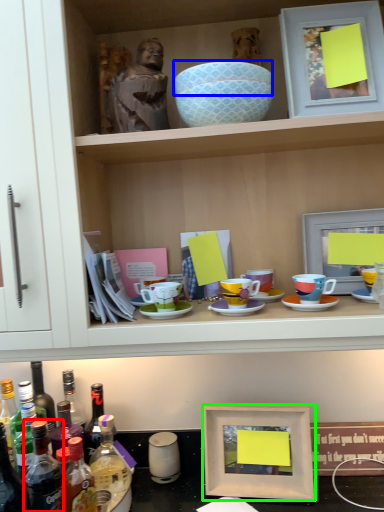
Question: Considering the real-world distances, which object is farthest from bottle (highlighted by a red box)? bowl (highlighted by a blue box) or picture frame (highlighted by a green box)?

Choices:
 (A) bowl
 (B) picture frame

Answer: (A)